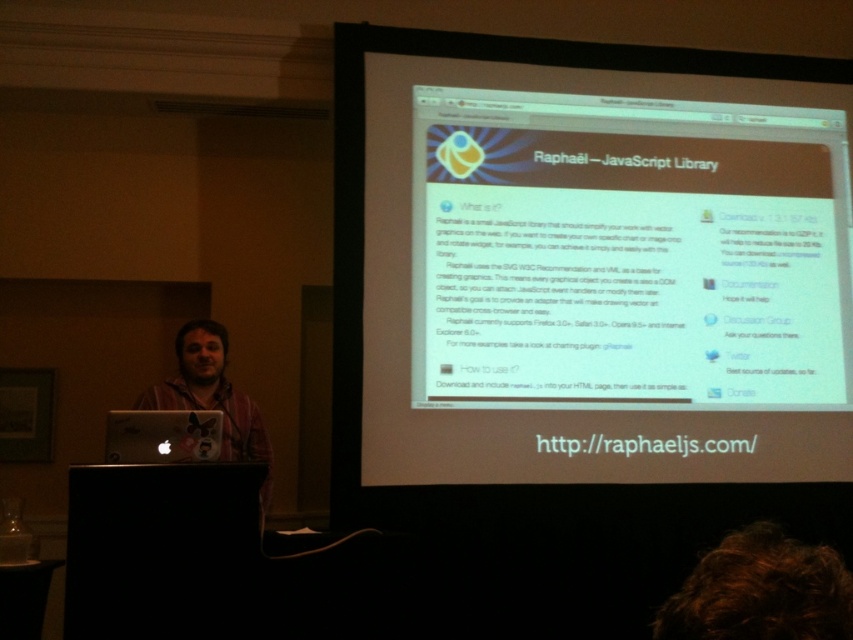
Question: Which of the following is the farthest from the observer?

Choices:
 (A) (155, 436)
 (B) (523, 468)

Answer: (B)

Question: Considering the real-world distances, which object is farthest from the white glossy computer screen at center?

Choices:
 (A) matte black laptop at left
 (B) matte gold laptop at center
 (C) brown hair at lower right

Answer: (B)

Question: Does brown hair at lower right have a greater width compared to matte black laptop at left?

Choices:
 (A) no
 (B) yes

Answer: (B)

Question: Which object is positioned closest to the white glossy computer screen at center?

Choices:
 (A) brown hair at lower right
 (B) matte black laptop at left

Answer: (B)

Question: Is white glossy computer screen at center wider than brown hair at lower right?

Choices:
 (A) no
 (B) yes

Answer: (B)

Question: Can you confirm if brown hair at lower right is wider than matte gold laptop at center?

Choices:
 (A) no
 (B) yes

Answer: (B)